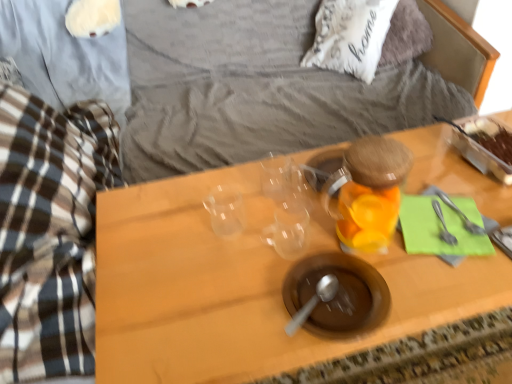
Locate an element on the screen. The image size is (512, 384). free space behind brown matte bowl at center is located at coordinates (294, 231).